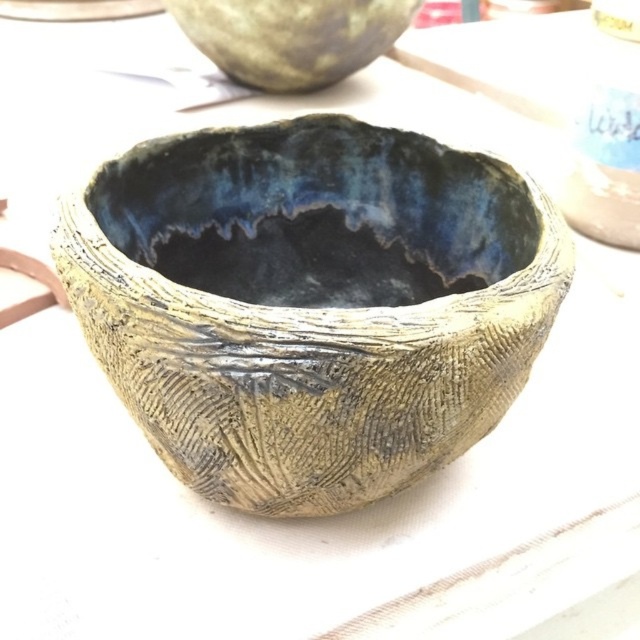
Question: Is textured clay bowl at center thinner than matte ceramic bowl at upper center?

Choices:
 (A) yes
 (B) no

Answer: (B)

Question: Does textured clay bowl at center appear on the right side of matte ceramic bowl at upper center?

Choices:
 (A) yes
 (B) no

Answer: (A)

Question: Is the position of textured clay bowl at center less distant than that of matte ceramic bowl at upper center?

Choices:
 (A) yes
 (B) no

Answer: (A)

Question: Which point is farther to the camera?

Choices:
 (A) (260, 444)
 (B) (236, 51)

Answer: (B)